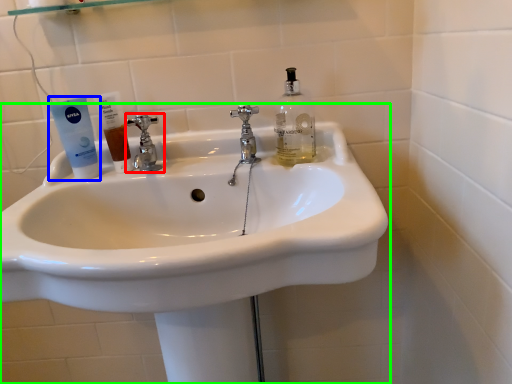
Question: Considering the real-world distances, which object is closest to tap (highlighted by a red box)? toothpaste (highlighted by a blue box) or sink (highlighted by a green box).

Choices:
 (A) toothpaste
 (B) sink

Answer: (A)